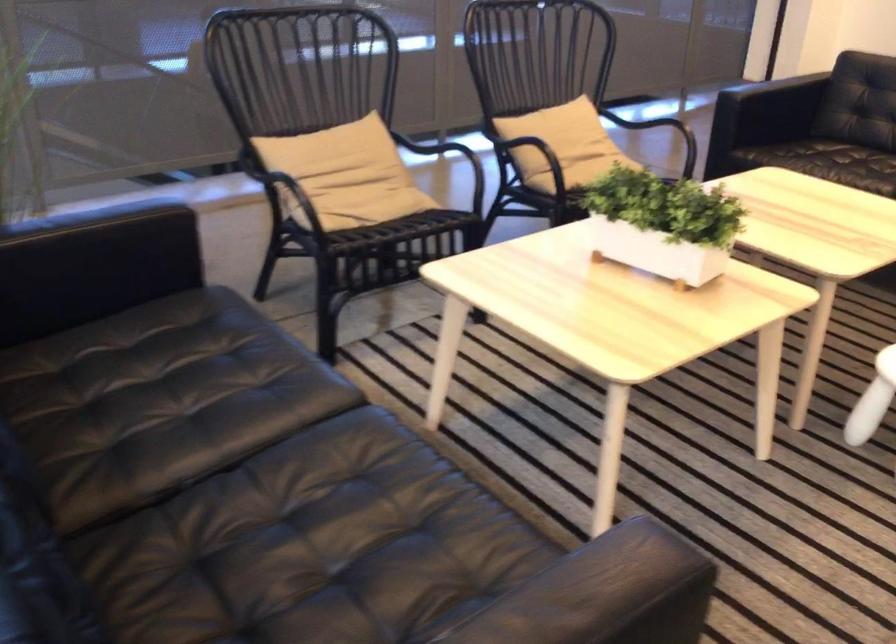
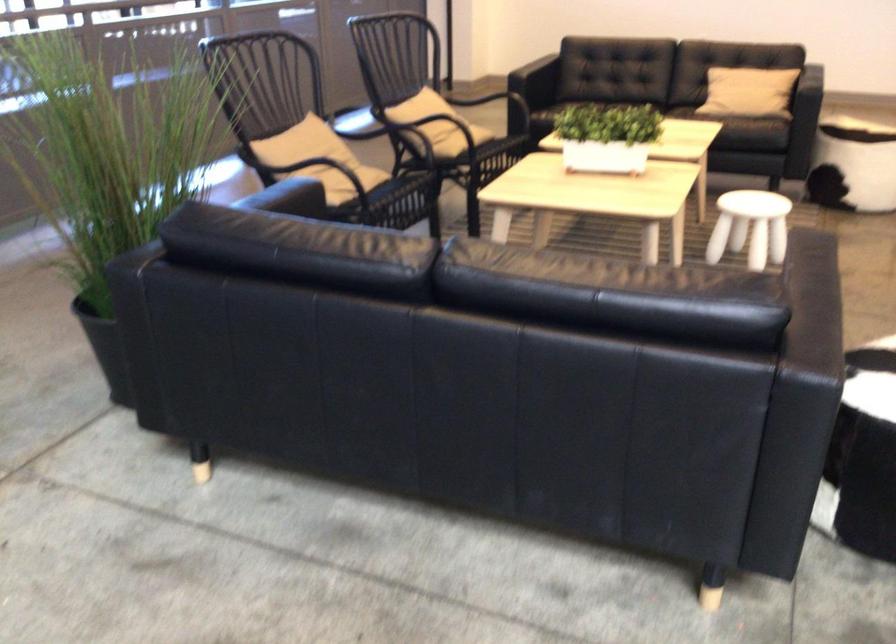
In the second image, find the point that corresponds to point 643,220 in the first image.

(607, 137)